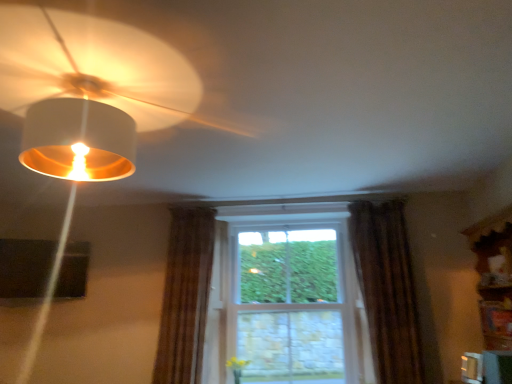
Question: Does point (415, 324) appear closer or farther from the camera than point (178, 304)?

Choices:
 (A) farther
 (B) closer

Answer: (B)

Question: From a real-world perspective, relative to brown textured curtain at center, placed as the first curtain when sorted from left to right, is brown textured curtain at right, which appears as the second curtain when viewed from the left, vertically above or below?

Choices:
 (A) above
 (B) below

Answer: (A)

Question: Estimate the real-world distances between objects in this image. Which object is farther from the clear glass window at center?

Choices:
 (A) brown textured curtain at center, placed as the first curtain when sorted from left to right
 (B) matte white lampshade at upper left
 (C) brown textured curtain at right, arranged as the 1th curtain when viewed from the right

Answer: (B)

Question: Estimate the real-world distances between objects in this image. Which object is closer to the brown textured curtain at center, placed as the first curtain when sorted from left to right?

Choices:
 (A) matte white lampshade at upper left
 (B) clear glass window at center
 (C) brown textured curtain at right, which appears as the second curtain when viewed from the left

Answer: (B)